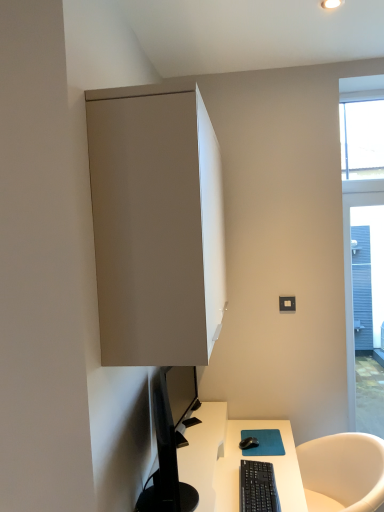
Question: Based on their sizes in the image, would you say clear glass window at upper right is bigger or smaller than black plastic keyboard at lower center?

Choices:
 (A) big
 (B) small

Answer: (A)

Question: From their relative heights in the image, would you say clear glass window at upper right is taller or shorter than black plastic keyboard at lower center?

Choices:
 (A) short
 (B) tall

Answer: (B)

Question: Estimate the real-world distances between objects in this image. Which object is closer to the white glossy desk at lower center?

Choices:
 (A) black glossy monitor at lower left
 (B) clear glass window at upper right
 (C) matte gray cabinet at upper left
 (D) black plastic keyboard at lower center
 (E) black matte mouse at lower center

Answer: (D)

Question: Which object is positioned farthest from the white glossy desk at lower center?

Choices:
 (A) black matte mouse at lower center
 (B) black glossy monitor at lower left
 (C) black plastic keyboard at lower center
 (D) matte gray cabinet at upper left
 (E) clear glass window at upper right

Answer: (E)